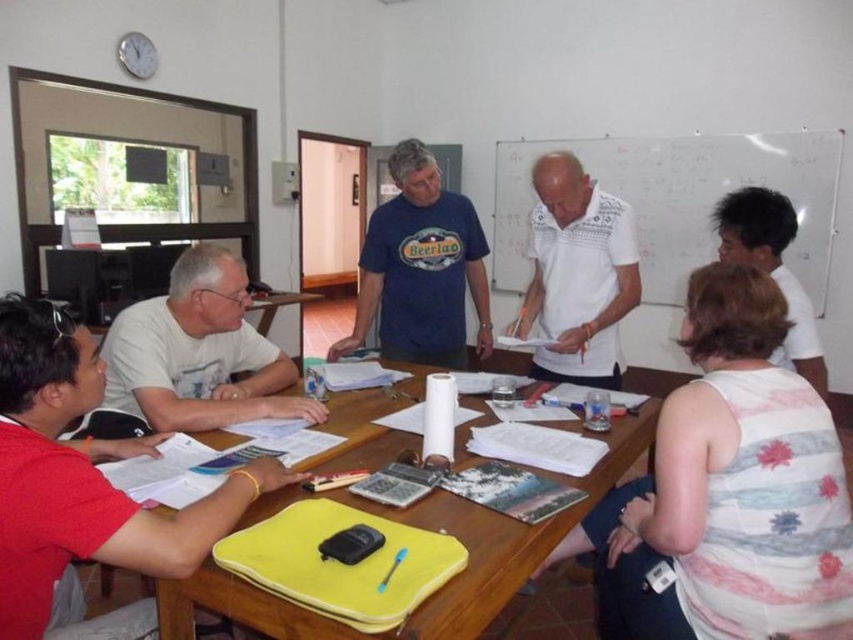
Who is shorter, matte red shirt at lower left or white textured shirt at center?

With less height is matte red shirt at lower left.

Who is positioned more to the right, matte red shirt at lower left or white textured shirt at center?

white textured shirt at center is more to the right.

This screenshot has height=640, width=853. What do you see at coordinates (82, 476) in the screenshot?
I see `matte red shirt at lower left` at bounding box center [82, 476].

The width and height of the screenshot is (853, 640). What are the coordinates of `matte red shirt at lower left` in the screenshot? It's located at (82, 476).

Between matte red shirt at lower left and yellow fabric at center, which one has more height?

matte red shirt at lower left

Which is more to the right, matte red shirt at lower left or yellow fabric at center?

Positioned to the right is yellow fabric at center.

Does point (50, 378) come farther from viewer compared to point (479, 404)?

No, (50, 378) is closer to viewer.

Where is `matte red shirt at lower left`? The width and height of the screenshot is (853, 640). matte red shirt at lower left is located at coordinates (82, 476).

Does blue cotton t-shirt at center appear on the left side of white textured shirt at center?

Correct, you'll find blue cotton t-shirt at center to the left of white textured shirt at center.

Which is in front, point (416, 298) or point (543, 173)?

Positioned in front is point (543, 173).

The image size is (853, 640). What are the coordinates of `blue cotton t-shirt at center` in the screenshot? It's located at (421, 268).